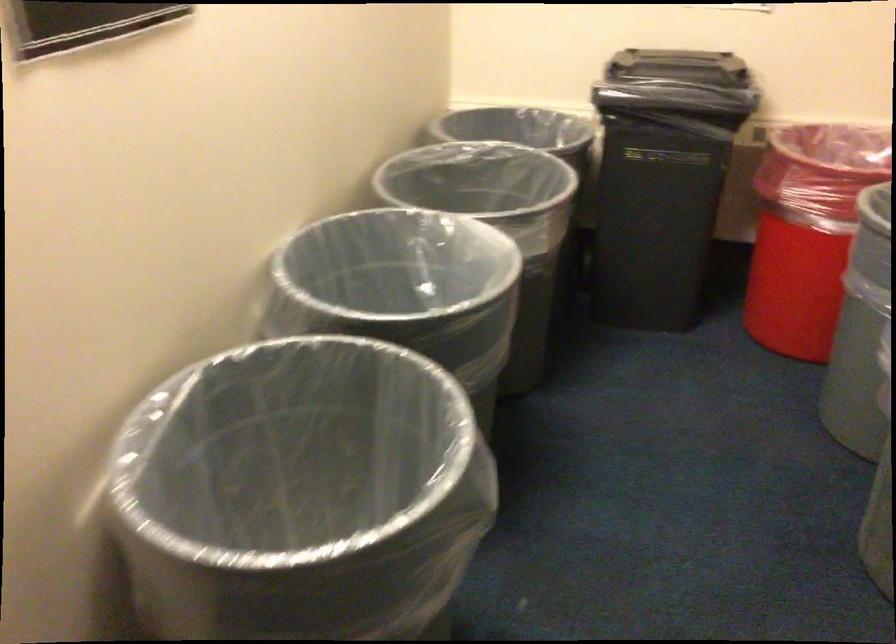
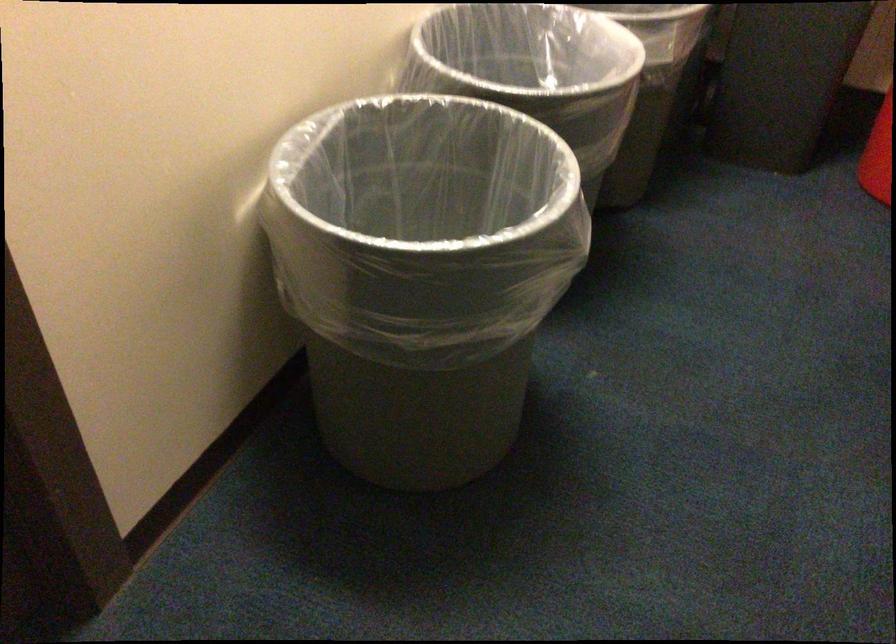
Locate, in the second image, the point that corresponds to point (300, 480) in the first image.

(410, 231)